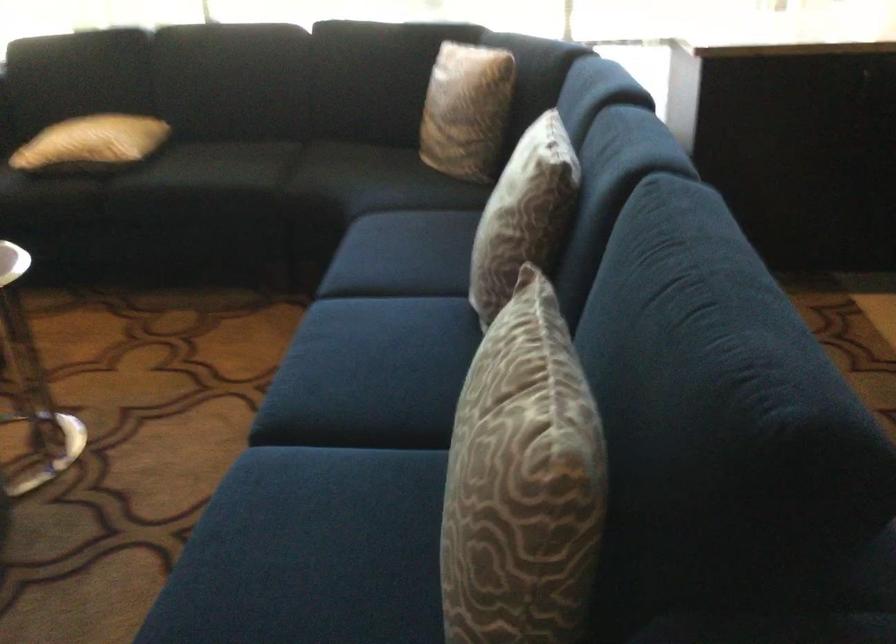
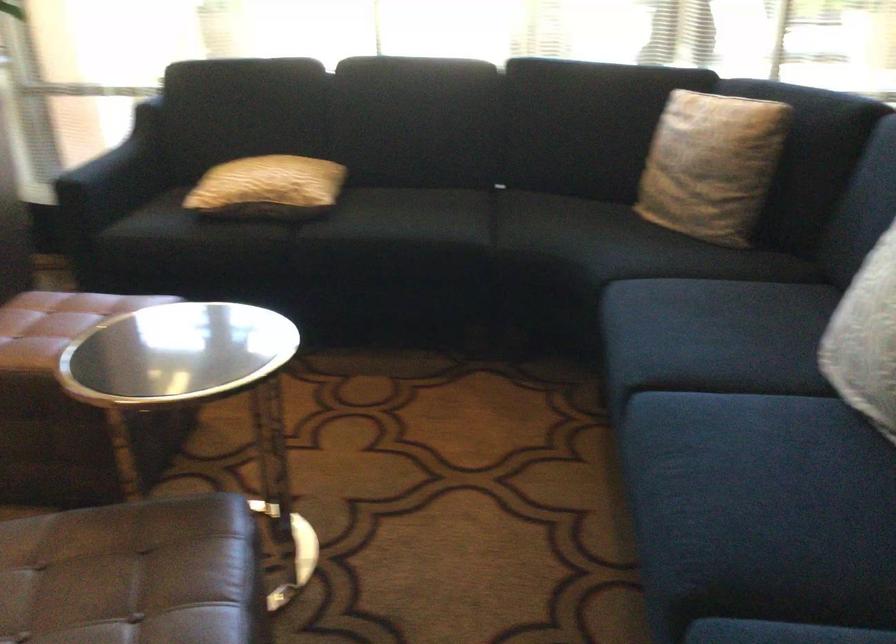
Find the pixel in the second image that matches [458,111] in the first image.

(711, 165)